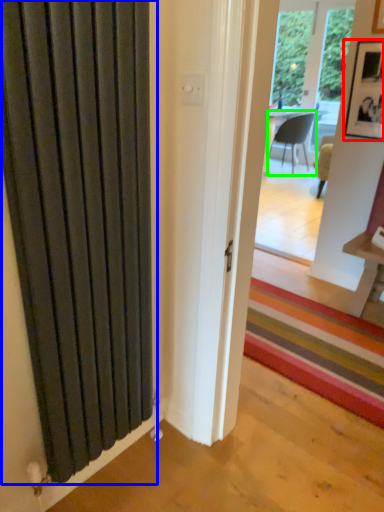
Question: Based on their relative distances, which object is nearer to picture frame (highlighted by a red box)? Choose from door (highlighted by a blue box) and chair (highlighted by a green box).

Choices:
 (A) door
 (B) chair

Answer: (A)